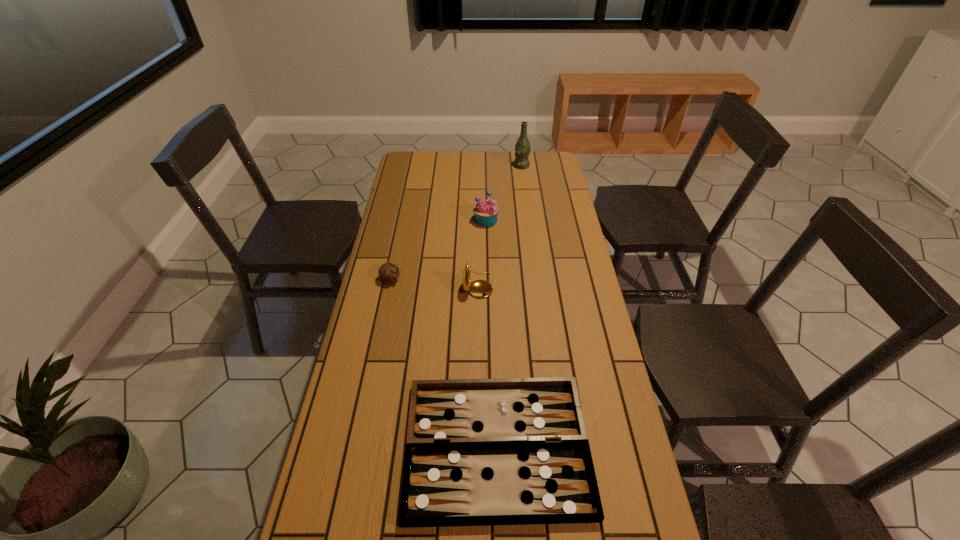
Where is `the farthest object`? the farthest object is located at coordinates (523, 147).

Locate an element on the screen. The image size is (960, 540). beer bottle is located at coordinates (523, 147).

This screenshot has width=960, height=540. I want to click on pocket watch, so click(480, 288).

Find the location of a particular element. The width and height of the screenshot is (960, 540). the second farthest object is located at coordinates (486, 211).

You are a GUI agent. You are given a task and a screenshot of the screen. Output one action in this format:
    pyautogui.click(x=<x>, y=<y>)
    Task: Click on the taller muffin
    Image resolution: width=960 pixels, height=540 pixels.
    Given the screenshot: What is the action you would take?
    pyautogui.click(x=486, y=211)

Image resolution: width=960 pixels, height=540 pixels. Identify the location of the left muffin. (388, 272).

This screenshot has height=540, width=960. I want to click on the leftmost object, so click(x=388, y=272).

Image resolution: width=960 pixels, height=540 pixels. Identify the location of the shortest object. (510, 451).

Where is `the nearest object`? The image size is (960, 540). the nearest object is located at coordinates (510, 451).

Identify the location of free region located on the surface of the tallest object. This screenshot has height=540, width=960. (448, 166).